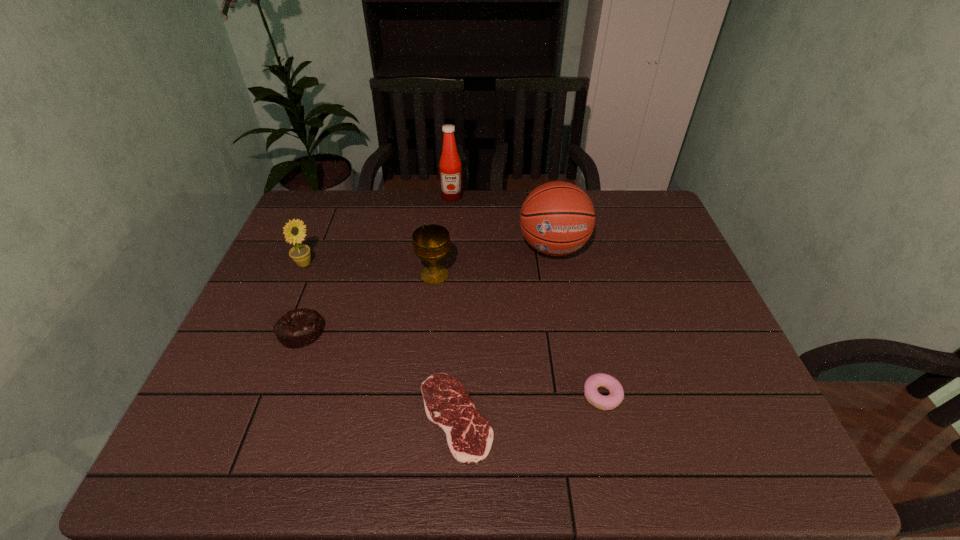
The width and height of the screenshot is (960, 540). Identify the location of the tallest object. (450, 166).

Locate an element on the screen. condiment is located at coordinates (450, 166).

Where is `basketball`? This screenshot has height=540, width=960. basketball is located at coordinates (557, 218).

The width and height of the screenshot is (960, 540). I want to click on sunflower, so click(300, 254).

Identify the location of chalice. This screenshot has width=960, height=540. (431, 243).

I want to click on beanbag, so click(x=298, y=328).

You are a GUI agent. You are given a task and a screenshot of the screen. Output one action in this format:
    pyautogui.click(x=<x>, y=<y>)
    Task: Click on the fifth tallest object
    The width and height of the screenshot is (960, 540).
    Given the screenshot: What is the action you would take?
    pyautogui.click(x=298, y=328)

You are a GUI agent. You are given a task and a screenshot of the screen. Output one action in this format:
    pyautogui.click(x=<x>, y=<y>)
    Task: Click on the second shortest object
    The width and height of the screenshot is (960, 540).
    Given the screenshot: What is the action you would take?
    pyautogui.click(x=595, y=381)

The image size is (960, 540). Identify the location of the shortest object. coord(469,435).

The height and width of the screenshot is (540, 960). Identify the location of vacant point located 0.350m on the front-facing side of the condiment. (445, 272).